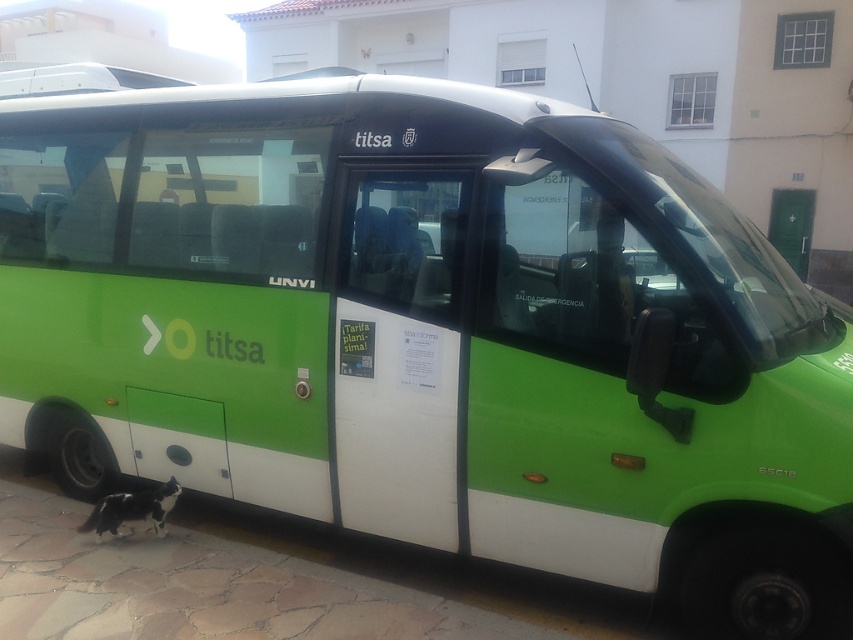
Who is more distant from viewer, (370, 600) or (141, 522)?

The point (141, 522) is more distant.

Is point (24, 550) positioned before point (167, 490)?

Yes, it is in front of point (167, 490).

Locate an element on the screen. The image size is (853, 640). black rubber curb at lower left is located at coordinates (206, 588).